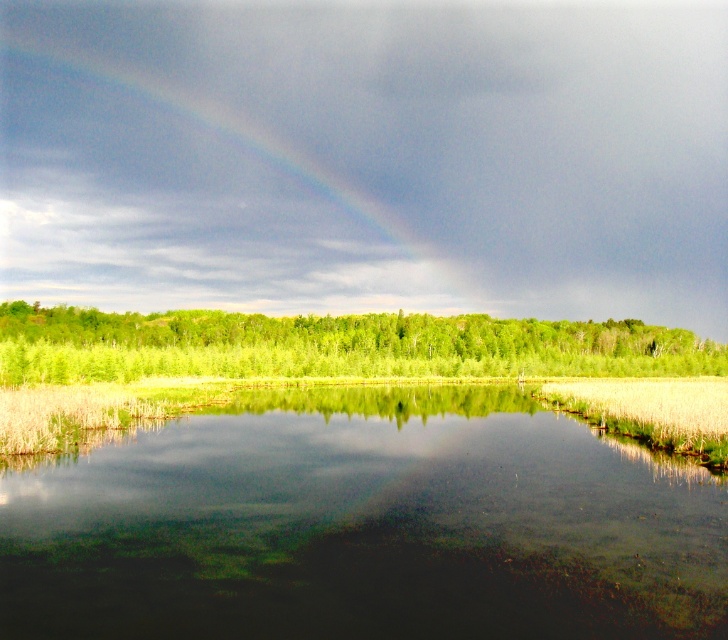
You are an observer looking at the landscape. You see the rainbow at upper center and the green leafy trees at center. Which object is positioned higher in the sky?

The rainbow at upper center is positioned higher in the sky than the green leafy trees at center.

You are standing at the edge of the water and want to take a photo of the green leafy trees at center. Since the clear water at center is between you and the trees, will the trees be visible in the reflection of the water?

The clear water at center is in front of green leafy trees at center, so the trees are behind the water. Since the water is clear, the trees at center will be visible in the reflection of the clear water at center.

You are standing on the shore of the serene lake and want to take a photo of the rainbow at upper center and the clear water at center. Which object should you frame first in your camera to ensure both are in the shot?

You should frame the rainbow at upper center first because the clear water at center is to the right of it, so positioning the rainbow first ensures both can be included in the shot.